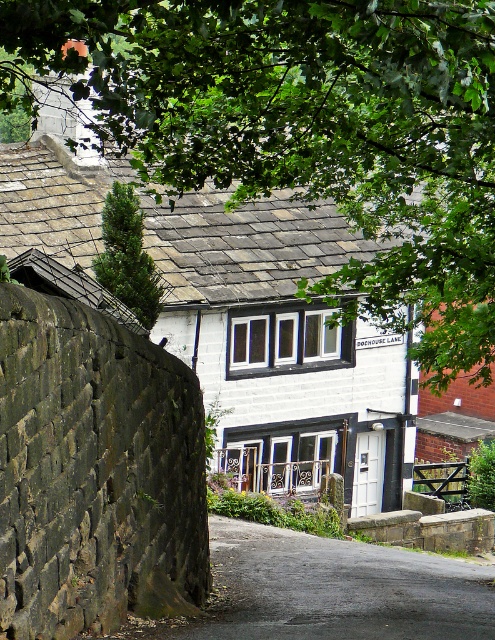
Question: Which point is closer to the camera?

Choices:
 (A) (116, 266)
 (B) (332, 157)

Answer: (B)

Question: Is green leafy tree at upper center further to camera compared to green coniferous tree at upper left?

Choices:
 (A) yes
 (B) no

Answer: (B)

Question: Which point appears closest to the camera in this image?

Choices:
 (A) coord(403,326)
 (B) coord(116,269)

Answer: (A)

Question: Is the position of green leafy tree at upper center more distant than that of green coniferous tree at upper left?

Choices:
 (A) yes
 (B) no

Answer: (B)

Question: Is green leafy tree at upper center further to camera compared to green coniferous tree at upper left?

Choices:
 (A) no
 (B) yes

Answer: (A)